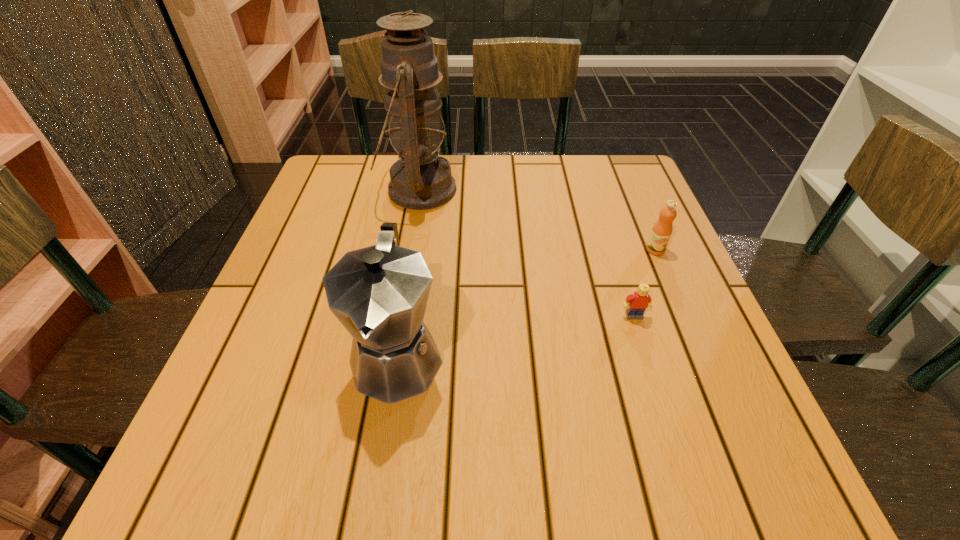
Identify the location of blank space located on the front-facing side of the Lego. The image size is (960, 540). (642, 341).

Identify the location of object at the far edge. This screenshot has width=960, height=540. (420, 179).

What are the coordinates of `orange juice at the right edge` in the screenshot? It's located at (661, 232).

In order to click on Lego present at the right edge in this screenshot , I will do `click(636, 303)`.

Locate an element on the screen. Image resolution: width=960 pixels, height=540 pixels. free location at the far edge is located at coordinates [x=482, y=176].

Identify the location of vacant area at the near edge. (404, 493).

Locate an element on the screen. The image size is (960, 540). free space at the left edge of the desktop is located at coordinates (327, 313).

In the image, there is a desktop. Find the location of `free space at the right edge`. free space at the right edge is located at coordinates (623, 269).

Where is `vacant space at the far left corner of the desktop`? vacant space at the far left corner of the desktop is located at coordinates (376, 171).

Locate an element on the screen. The image size is (960, 540). vacant space at the far right corner of the desktop is located at coordinates (621, 163).